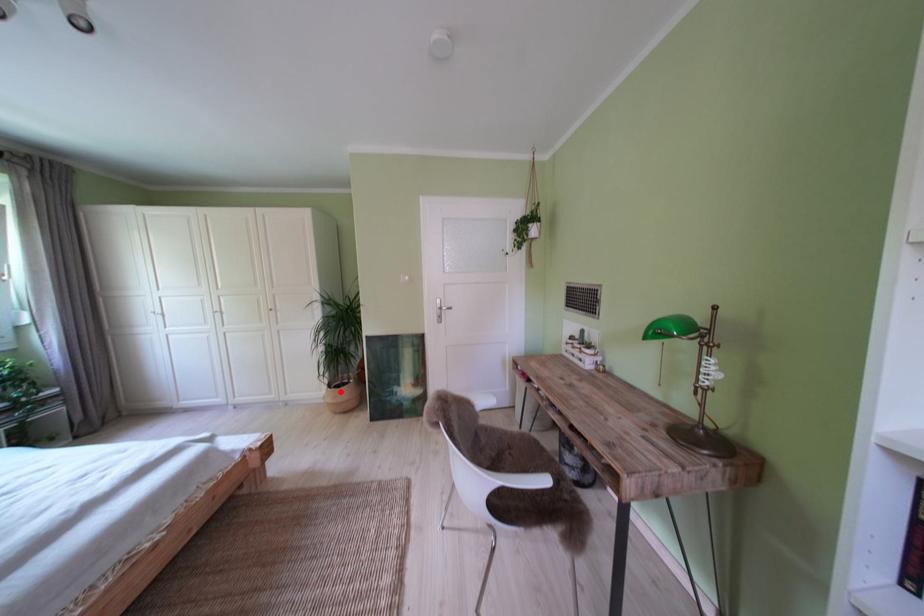
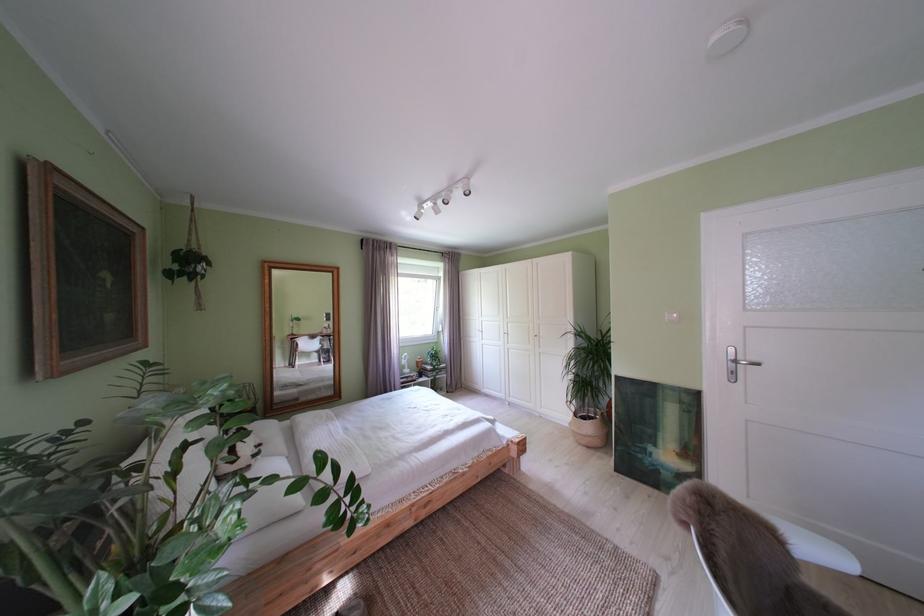
Question: I am providing you with two images of the same scene from different viewpoints. A red point is marked on the first image. At the location where the point appears in image 1, is it still visible in image 2?

Choices:
 (A) Yes
 (B) No

Answer: (A)